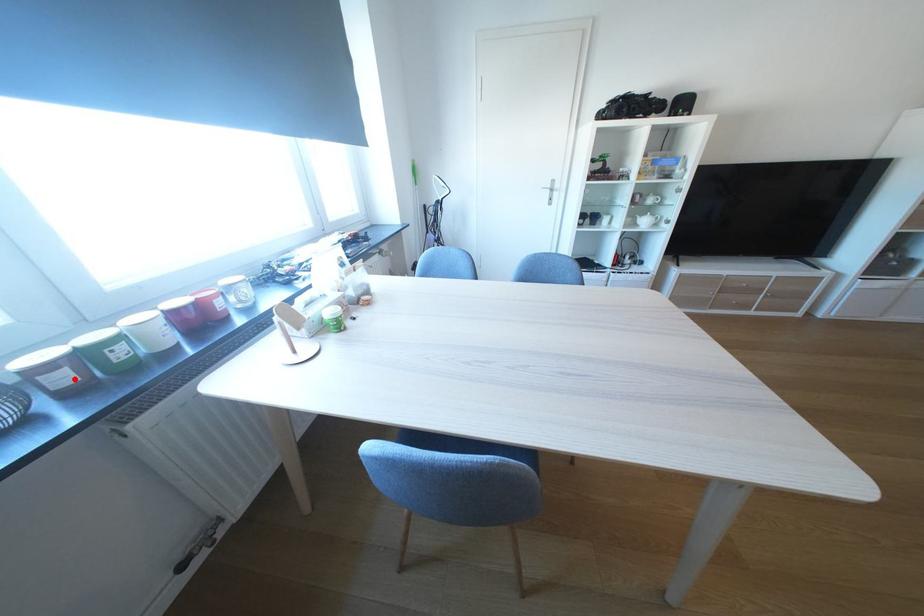
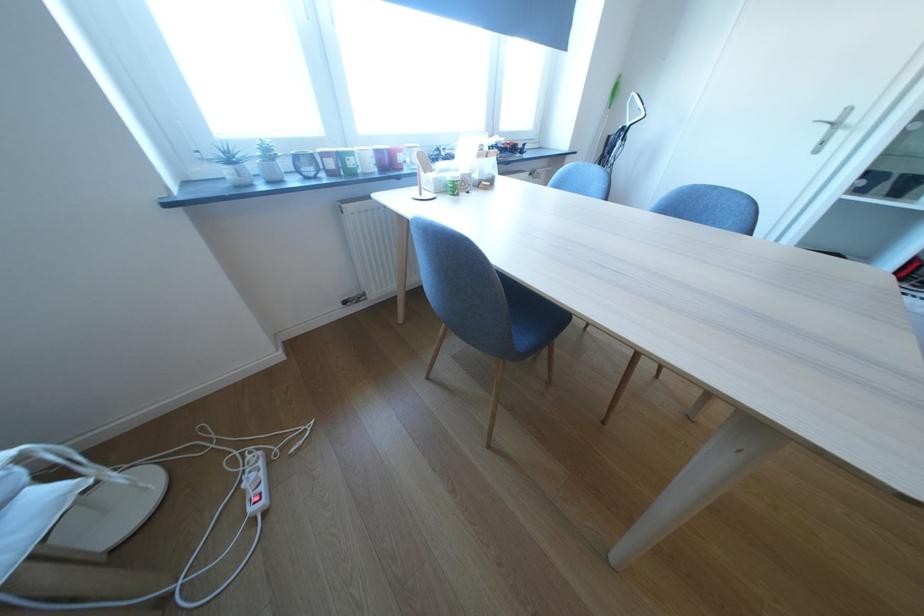
In the second image, find the point that corresponds to the highlighted location in the first image.

(342, 164)